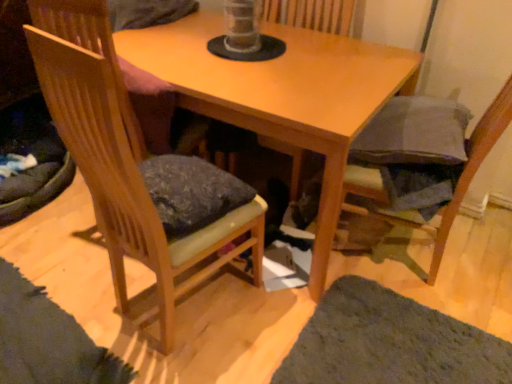
You are a GUI agent. You are given a task and a screenshot of the screen. Output one action in this format:
    pyautogui.click(x=<x>, y=<y>)
    Task: Click on the wooden table at center
    
    Given the screenshot: What is the action you would take?
    (282, 94)

Describe the element at coordinates (390, 343) in the screenshot. This screenshot has height=384, width=512. I see `green shaggy rug at lower right` at that location.

You are a GUI agent. You are given a task and a screenshot of the screen. Output one action in this format:
    pyautogui.click(x=<x>, y=<y>)
    Task: Click on the wooden swivel chair at center
    This screenshot has width=512, height=384.
    Given the screenshot: What is the action you would take?
    [x=312, y=14]

Looking at this image, is green shaggy rug at lower right completely or partially inside wooden table at center?

No, green shaggy rug at lower right is not surrounded by wooden table at center.

Is point (120, 53) positioned behind point (396, 373)?

Yes, it is.

Could you tell me if wooden table at center is turned towards green shaggy rug at lower right?

No, wooden table at center is not oriented towards green shaggy rug at lower right.

How many degrees apart are the facing directions of wooden table at center and green shaggy rug at lower right?

The angular difference between wooden table at center and green shaggy rug at lower right is 90.8 degrees.

From a real-world perspective, is wooden chair at left, acting as the first chair starting from the left, positioned above or below wooden table at center?

From a real-world perspective, wooden chair at left, acting as the first chair starting from the left, is physically above wooden table at center.

From the picture: Which is closer, (130,208) or (253,74)?

The point (130,208) is closer.

Is wooden chair at left, which appears as the 2th chair when viewed from the right, thinner than wooden table at center?

Indeed, wooden chair at left, which appears as the 2th chair when viewed from the right, has a lesser width compared to wooden table at center.

Is wooden chair at left, which appears as the 2th chair when viewed from the right, at the left side of wooden table at center?

Indeed, wooden chair at left, which appears as the 2th chair when viewed from the right, is positioned on the left side of wooden table at center.

Between wooden chair at left, acting as the first chair starting from the left, and wooden swivel chair at center, which one has smaller size?

Smaller between the two is wooden swivel chair at center.

Would you say wooden chair at left, acting as the first chair starting from the left, contains wooden swivel chair at center?

No, wooden swivel chair at center is located outside of wooden chair at left, acting as the first chair starting from the left.

From the image's perspective, between wooden chair at left, acting as the first chair starting from the left, and wooden swivel chair at center, who is located below?

wooden chair at left, acting as the first chair starting from the left, from the image's perspective.

From the image's perspective, between wooden swivel chair at center and green shaggy rug at lower right, who is located below?

green shaggy rug at lower right.

Does wooden swivel chair at center turn towards green shaggy rug at lower right?

No, wooden swivel chair at center is not facing towards green shaggy rug at lower right.

Which is closer, (x=347, y=0) or (x=370, y=343)?

Point (x=347, y=0).

Which is correct: wooden swivel chair at center is inside green shaggy rug at lower right, or outside of it?

wooden swivel chair at center is located beyond the bounds of green shaggy rug at lower right.

Is green shaggy rug at lower right inside or outside of wooden table at center?

green shaggy rug at lower right is outside wooden table at center.

From the image's perspective, between green shaggy rug at lower right and wooden table at center, which one is located above?

wooden table at center appears higher in the image.

Considering the relative positions of green shaggy rug at lower right and wooden table at center in the image provided, is green shaggy rug at lower right behind wooden table at center?

No, the depth of green shaggy rug at lower right is less than that of wooden table at center.

Does green shaggy rug at lower right turn towards wooden table at center?

No, green shaggy rug at lower right does not turn towards wooden table at center.

Looking at the image, does wooden chair at left, acting as the first chair starting from the left, seem bigger or smaller compared to dark gray fabric cushion at lower right, which is the 1th chair from right to left?

Considering their sizes, wooden chair at left, acting as the first chair starting from the left, takes up less space than dark gray fabric cushion at lower right, which is the 1th chair from right to left.

From their relative heights in the image, would you say wooden chair at left, which appears as the 2th chair when viewed from the right, is taller or shorter than dark gray fabric cushion at lower right, which is the 1th chair from right to left?

Clearly, wooden chair at left, which appears as the 2th chair when viewed from the right, is shorter compared to dark gray fabric cushion at lower right, which is the 1th chair from right to left.

Is wooden chair at left, which appears as the 2th chair when viewed from the right, at the left side of dark gray fabric cushion at lower right, which is the 1th chair from right to left?

Correct, you'll find wooden chair at left, which appears as the 2th chair when viewed from the right, to the left of dark gray fabric cushion at lower right, which is the 1th chair from right to left.

Does wooden chair at left, acting as the first chair starting from the left, turn towards dark gray fabric cushion at lower right, acting as the 2th chair starting from the left?

No, wooden chair at left, acting as the first chair starting from the left, is not aimed at dark gray fabric cushion at lower right, acting as the 2th chair starting from the left.

Can you confirm if wooden table at center is taller than wooden chair at left, acting as the first chair starting from the left?

In fact, wooden table at center may be shorter than wooden chair at left, acting as the first chair starting from the left.

Is wooden table at center facing away from wooden chair at left, acting as the first chair starting from the left?

No.

Would you say wooden table at center is a long distance from wooden chair at left, which appears as the 2th chair when viewed from the right?

Actually, wooden table at center and wooden chair at left, which appears as the 2th chair when viewed from the right, are a little close together.

The height and width of the screenshot is (384, 512). In order to click on chair that is the 2nd one when counting forward from the wooden table at center in this screenshot , I will do [x=122, y=160].

This screenshot has width=512, height=384. Identify the location of table behind the green shaggy rug at lower right. (282, 94).

From a real-world perspective, count 2nd chairs upward from the wooden table at center and point to it. Please provide its 2D coordinates.

[(122, 160)]

Based on their spatial positions, is dark gray fabric cushion at lower right, acting as the 2th chair starting from the left, or wooden swivel chair at center closer to wooden chair at left, which appears as the 2th chair when viewed from the right?

dark gray fabric cushion at lower right, acting as the 2th chair starting from the left.

Looking at the image, which one is located further to dark gray fabric cushion at lower right, acting as the 2th chair starting from the left, green shaggy rug at lower right or wooden swivel chair at center?

Among the two, wooden swivel chair at center is located further to dark gray fabric cushion at lower right, acting as the 2th chair starting from the left.

When comparing their distances from green shaggy rug at lower right, does wooden swivel chair at center or dark gray fabric cushion at lower right, which is the 1th chair from right to left, seem further?

Among the two, wooden swivel chair at center is located further to green shaggy rug at lower right.

Which object lies nearer to the anchor point wooden swivel chair at center, dark gray fabric cushion at lower right, acting as the 2th chair starting from the left, or green shaggy rug at lower right?

Among the two, dark gray fabric cushion at lower right, acting as the 2th chair starting from the left, is located nearer to wooden swivel chair at center.

Looking at the image, which one is located further to dark gray fabric cushion at lower right, acting as the 2th chair starting from the left, wooden swivel chair at center or wooden chair at left, which appears as the 2th chair when viewed from the right?

wooden swivel chair at center lies further to dark gray fabric cushion at lower right, acting as the 2th chair starting from the left, than the other object.

From the image, which object appears to be farther from wooden swivel chair at center, dark gray fabric cushion at lower right, acting as the 2th chair starting from the left, or wooden chair at left, which appears as the 2th chair when viewed from the right?

wooden chair at left, which appears as the 2th chair when viewed from the right, is further to wooden swivel chair at center.

Based on their spatial positions, is dark gray fabric cushion at lower right, which is the 1th chair from right to left, or wooden swivel chair at center closer to green shaggy rug at lower right?

Based on the image, dark gray fabric cushion at lower right, which is the 1th chair from right to left, appears to be nearer to green shaggy rug at lower right.

Estimate the real-world distances between objects in this image. Which object is further from wooden swivel chair at center, wooden chair at left, which appears as the 2th chair when viewed from the right, or dark gray fabric cushion at lower right, which is the 1th chair from right to left?

wooden chair at left, which appears as the 2th chair when viewed from the right, is further to wooden swivel chair at center.

Identify the location of mat between wooden chair at left, acting as the first chair starting from the left, and dark gray fabric cushion at lower right, acting as the 2th chair starting from the left, from left to right. The width and height of the screenshot is (512, 384). (390, 343).

Identify the location of table between wooden chair at left, acting as the first chair starting from the left, and dark gray fabric cushion at lower right, acting as the 2th chair starting from the left. This screenshot has height=384, width=512. (282, 94).

Image resolution: width=512 pixels, height=384 pixels. Find the location of `table that lies between wooden swivel chair at center and green shaggy rug at lower right from top to bottom`. table that lies between wooden swivel chair at center and green shaggy rug at lower right from top to bottom is located at coordinates (282, 94).

Image resolution: width=512 pixels, height=384 pixels. Identify the location of swivel chair between wooden chair at left, which appears as the 2th chair when viewed from the right, and dark gray fabric cushion at lower right, acting as the 2th chair starting from the left, from left to right. (312, 14).